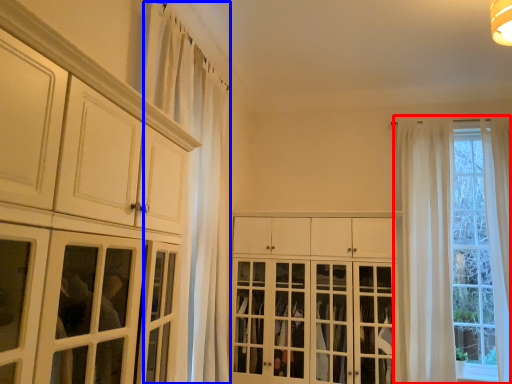
Question: Which point is closer to the camera, window (highlighted by a red box) or curtain (highlighted by a blue box)?

Choices:
 (A) window
 (B) curtain

Answer: (B)